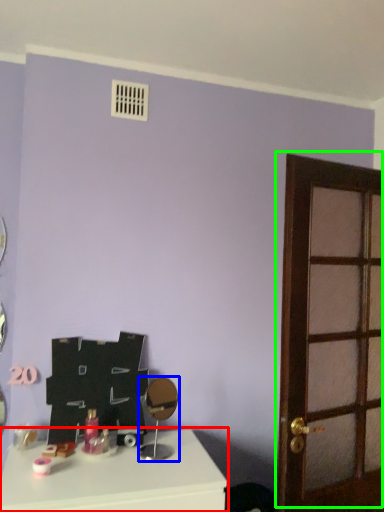
Question: Based on their relative distances, which object is farther from table (highlighted by a red box)? Choose from mirror (highlighted by a blue box) and door (highlighted by a green box).

Choices:
 (A) mirror
 (B) door

Answer: (B)